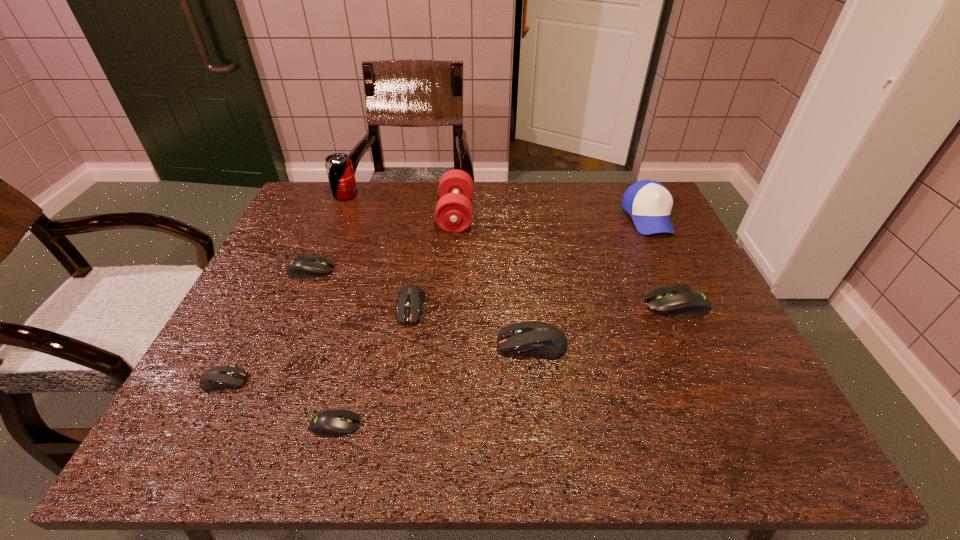
Find the location of `baseball cap present at the far edge`. baseball cap present at the far edge is located at coordinates [x=649, y=203].

At what (x,y) coordinates should I click in order to perform the action: click on object that is positioned at the near edge. Please return your answer as a coordinate pair (x, y). Looking at the image, I should click on (332, 423).

Where is `soda can positioned at the left edge`? This screenshot has width=960, height=540. soda can positioned at the left edge is located at coordinates (339, 168).

The image size is (960, 540). I want to click on baseball cap at the right edge, so click(x=649, y=203).

Where is `computer mouse that is at the right edge`? This screenshot has width=960, height=540. computer mouse that is at the right edge is located at coordinates (684, 301).

Find the location of a particular element. object located in the far left corner section of the desktop is located at coordinates (339, 168).

Find the location of a particular element. Image resolution: width=960 pixels, height=540 pixels. object that is at the far right corner is located at coordinates (649, 203).

The width and height of the screenshot is (960, 540). Identify the location of free region at the far edge of the desktop. (359, 187).

This screenshot has width=960, height=540. Find the location of `free space at the near edge of the desktop`. free space at the near edge of the desktop is located at coordinates (359, 429).

The width and height of the screenshot is (960, 540). Identify the location of vacant space at the left edge of the desktop. (242, 305).